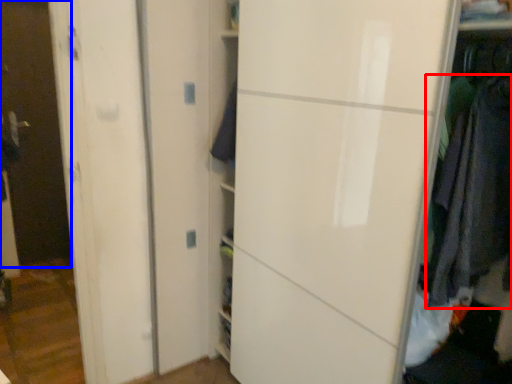
Question: Which object is closer to the camera taking this photo, clothing (highlighted by a red box) or glass door (highlighted by a blue box)?

Choices:
 (A) clothing
 (B) glass door

Answer: (A)